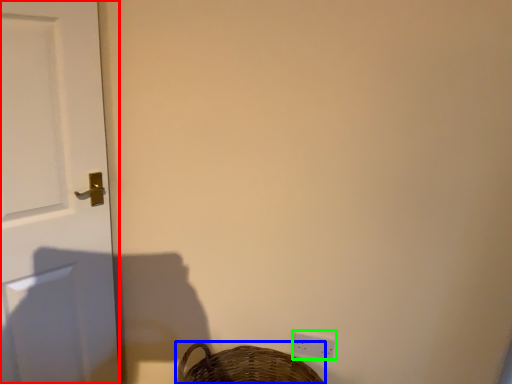
Question: Based on their relative distances, which object is nearer to door (highlighted by a red box)? Choose from basket (highlighted by a blue box) and light switch (highlighted by a green box).

Choices:
 (A) basket
 (B) light switch

Answer: (A)